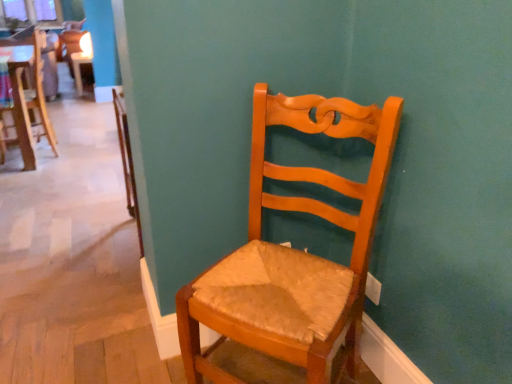
Question: From the image's perspective, is wooden chair at center, placed as the 1th chair when sorted from back to front, above or below wooden chair with woven seat cushion at center, which ranks as the first chair in front-to-back order?

Choices:
 (A) above
 (B) below

Answer: (A)

Question: From a real-world perspective, is wooden chair at center, marked as the third chair in a front-to-back arrangement, physically located above or below wooden chair with woven seat cushion at center, positioned as the 1th chair in right-to-left order?

Choices:
 (A) below
 (B) above

Answer: (A)

Question: Estimate the real-world distances between objects in this image. Which object is closer to the wooden chair at center, the 3th chair viewed from the right?

Choices:
 (A) wooden chair with woven seat cushion at center, arranged as the third chair when viewed from the back
 (B) wooden chair at center, the 2th chair when ordered from top to bottom

Answer: (B)

Question: Based on their relative distances, which object is farther from the wooden chair at center, placed as the 1th chair when sorted from back to front?

Choices:
 (A) wooden chair with woven seat cushion at center, arranged as the third chair when viewed from the back
 (B) wooden chair at center, which ranks as the 2th chair in left-to-right order

Answer: (A)